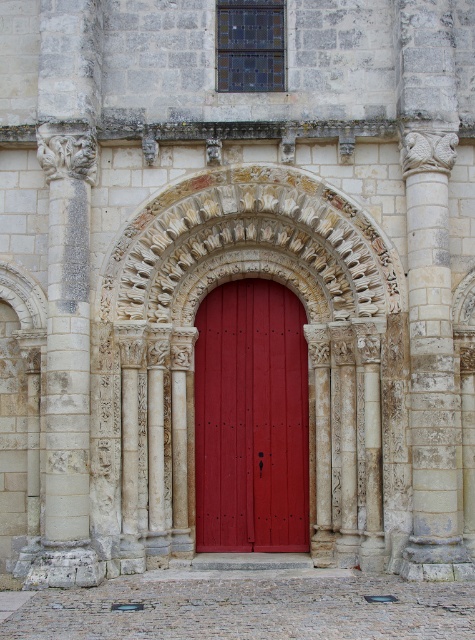
Question: Does carved stone archway at center appear on the left side of matte wood door at center?

Choices:
 (A) yes
 (B) no

Answer: (B)

Question: Can you confirm if carved stone archway at center is wider than matte wood door at center?

Choices:
 (A) yes
 (B) no

Answer: (A)

Question: Which of the following is the closest to the observer?

Choices:
 (A) (244, 433)
 (B) (359, 392)

Answer: (B)

Question: Does carved stone archway at center have a greater width compared to matte wood door at center?

Choices:
 (A) no
 (B) yes

Answer: (B)